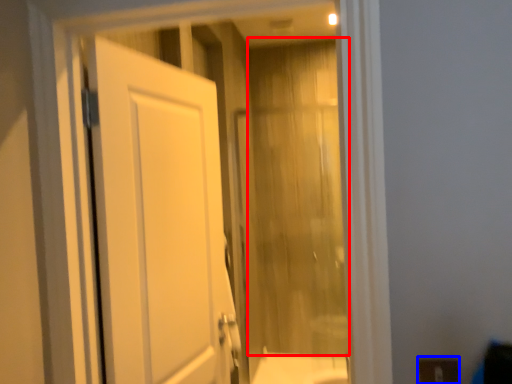
Question: Which point is further to the camera, curtain (highlighted by a red box) or electric outlet (highlighted by a blue box)?

Choices:
 (A) curtain
 (B) electric outlet

Answer: (A)